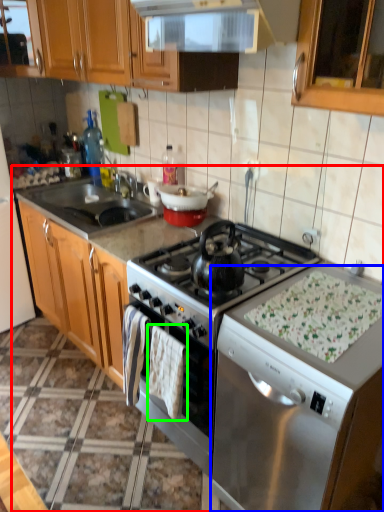
Question: Based on their relative distances, which object is farther from countertop (highlighted by a red box)? Choose from dish washer (highlighted by a blue box) and blanket (highlighted by a green box).

Choices:
 (A) dish washer
 (B) blanket

Answer: (A)